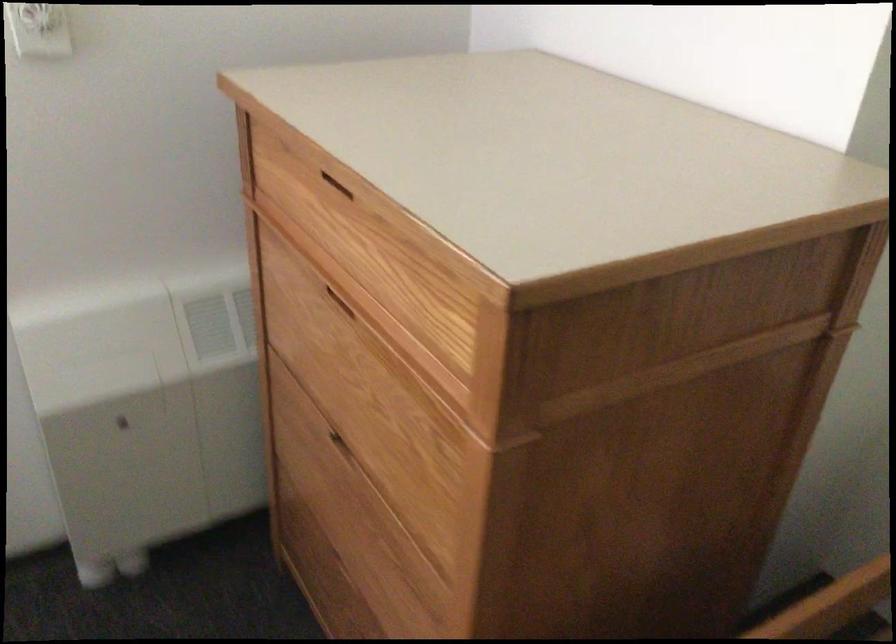
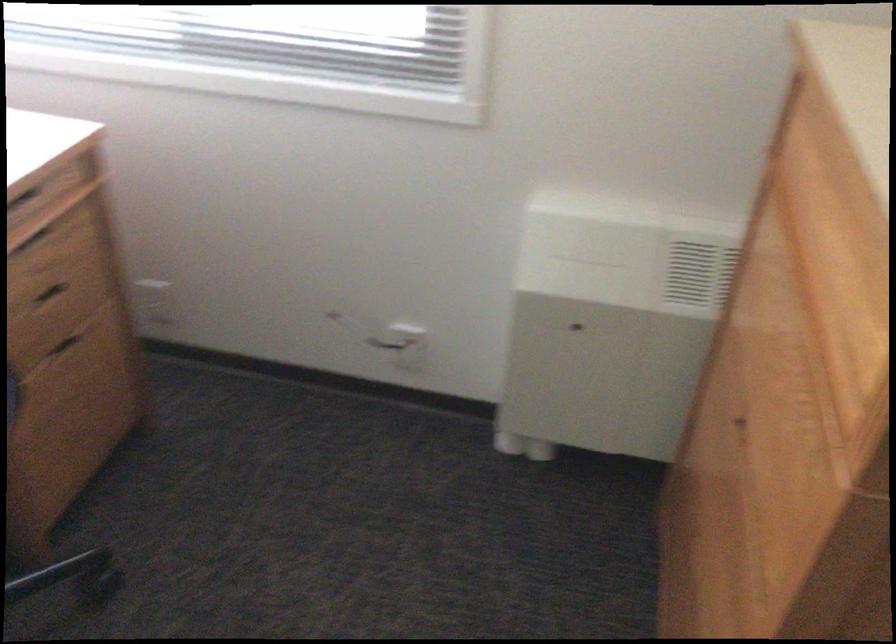
Question: The first image is from the beginning of the video and the second image is from the end. How did the camera likely rotate when shooting the video?

Choices:
 (A) Left
 (B) Right
 (C) Up
 (D) Down

Answer: (A)